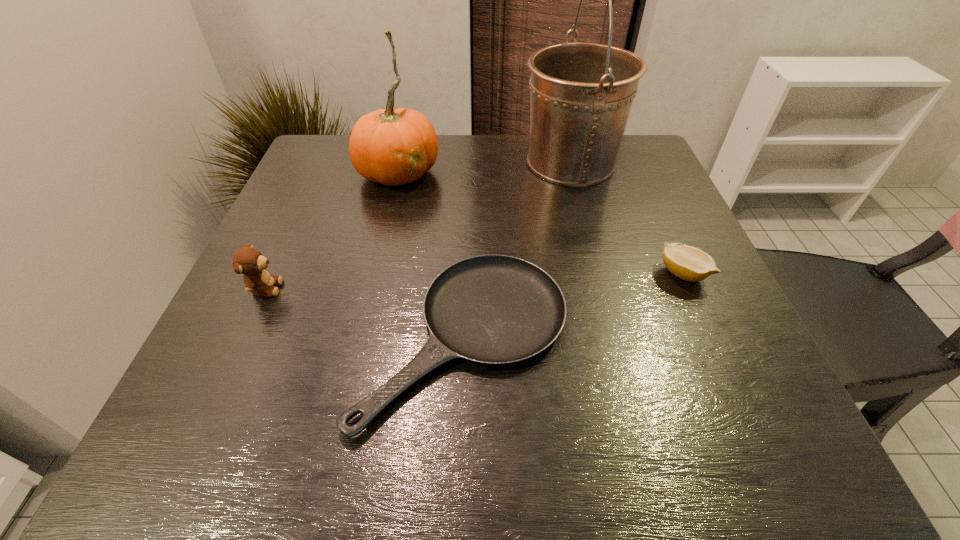
Image resolution: width=960 pixels, height=540 pixels. Identify the location of free space at the far edge of the desktop. (467, 137).

The width and height of the screenshot is (960, 540). I want to click on free spot at the left edge of the desktop, so click(x=293, y=194).

Find the location of a particular element. free region at the right edge of the desktop is located at coordinates (651, 285).

Image resolution: width=960 pixels, height=540 pixels. I want to click on blank area at the far left corner, so click(x=321, y=184).

The width and height of the screenshot is (960, 540). In the image, there is a desktop. Find the location of `vacant space at the near right corner`. vacant space at the near right corner is located at coordinates (748, 464).

The width and height of the screenshot is (960, 540). Find the location of `vacant region between the shortest object and the fourth shortest object`. vacant region between the shortest object and the fourth shortest object is located at coordinates (431, 255).

This screenshot has width=960, height=540. In order to click on blank region between the shortest object and the bucket in this screenshot , I will do `click(517, 250)`.

I want to click on unoccupied position between the shortest object and the bucket, so click(517, 250).

The width and height of the screenshot is (960, 540). I want to click on free spot between the frying pan and the lemon, so click(x=574, y=306).

At what (x,y) coordinates should I click in order to perform the action: click on free space between the lemon and the second tallest object. Please return your answer as a coordinate pair (x, y). The height and width of the screenshot is (540, 960). Looking at the image, I should click on (540, 222).